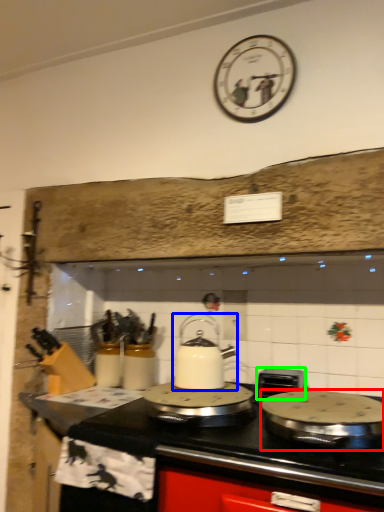
Question: Considering the real-world distances, which object is farthest from kitchen appliance (highlighted by a red box)? kitchen appliance (highlighted by a blue box) or appliance (highlighted by a green box)?

Choices:
 (A) kitchen appliance
 (B) appliance

Answer: (A)